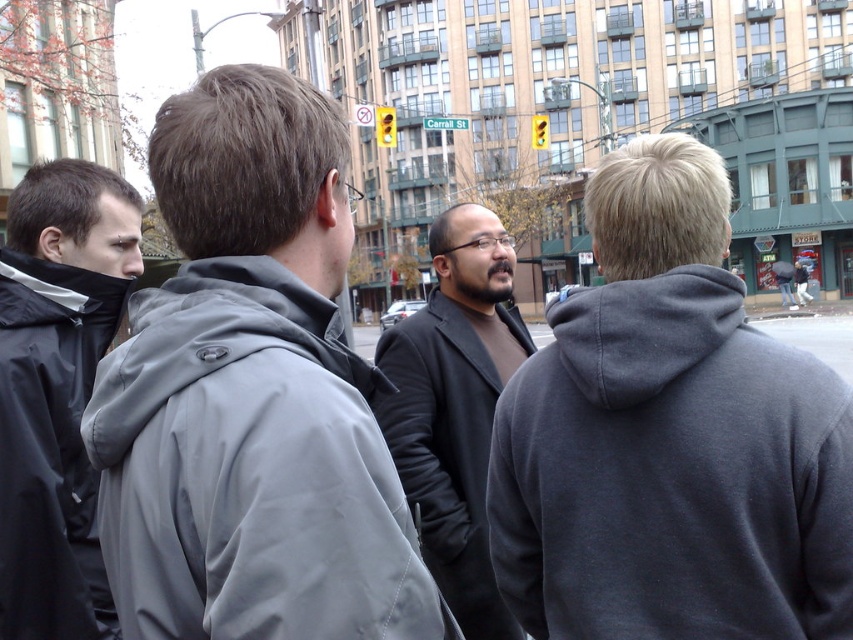
Question: Does gray synthetic jacket at upper left appear over dark gray coat at center?

Choices:
 (A) no
 (B) yes

Answer: (B)

Question: Which of the following is the farthest from the observer?

Choices:
 (A) dark gray hoodie at right
 (B) gray synthetic jacket at upper left
 (C) dark gray hoodie at center

Answer: (C)

Question: Which object appears closest to the camera in this image?

Choices:
 (A) gray synthetic jacket at upper left
 (B) dark gray hoodie at center
 (C) dark gray jacket at left

Answer: (A)

Question: Among these objects, which one is nearest to the camera?

Choices:
 (A) dark gray hoodie at right
 (B) dark gray jacket at left
 (C) gray synthetic jacket at upper left
 (D) dark gray hoodie at center

Answer: (C)

Question: Can you confirm if dark gray hoodie at right is positioned below gray synthetic jacket at upper left?

Choices:
 (A) yes
 (B) no

Answer: (B)

Question: Is gray synthetic jacket at upper left above dark gray coat at center?

Choices:
 (A) yes
 (B) no

Answer: (A)